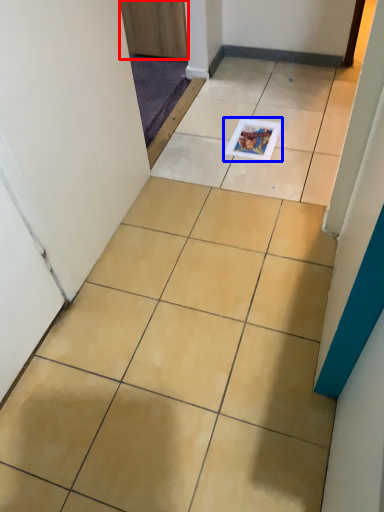
Question: Among these objects, which one is nearest to the camera, door (highlighted by a red box) or magazine (highlighted by a blue box)?

Choices:
 (A) door
 (B) magazine

Answer: (B)